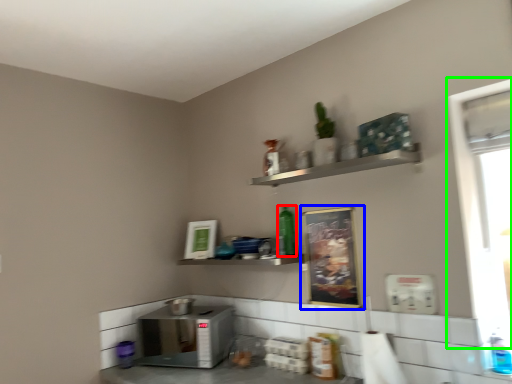
Question: Based on their relative distances, which object is farther from bottle (highlighted by a red box)? Choose from bulletin board (highlighted by a blue box) and window screen (highlighted by a green box).

Choices:
 (A) bulletin board
 (B) window screen

Answer: (B)